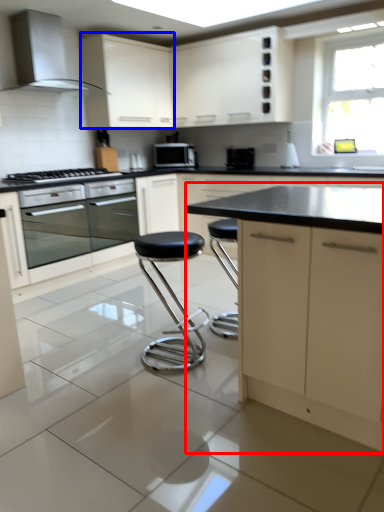
Question: Which point is closer to the camera, cabinetry (highlighted by a red box) or cabinetry (highlighted by a blue box)?

Choices:
 (A) cabinetry
 (B) cabinetry

Answer: (A)